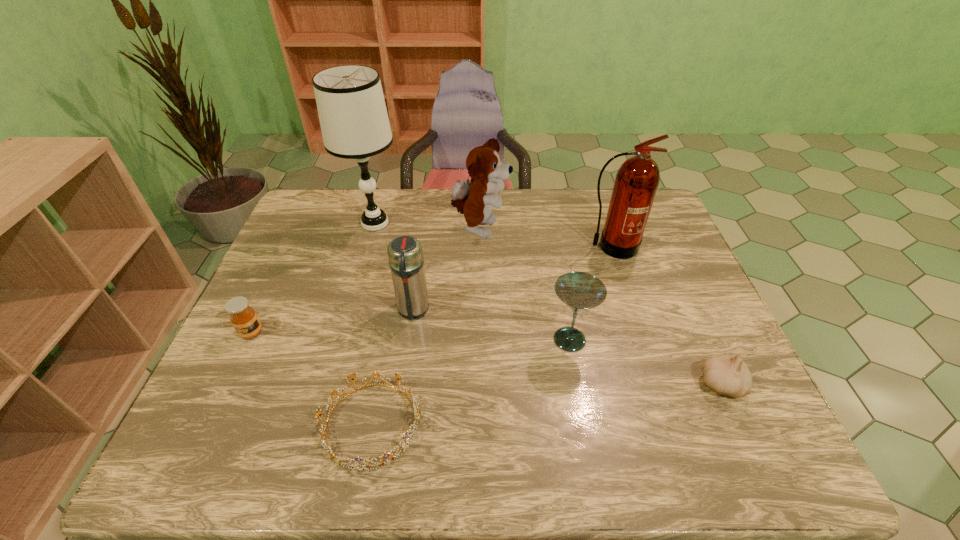
You are a GUI agent. You are given a task and a screenshot of the screen. Output one action in this format:
    pyautogui.click(x=<x>, y=<y>)
    Task: Click on the free point between the tallest object and the fourth object from right to left
    The height and width of the screenshot is (540, 960).
    Given the screenshot: What is the action you would take?
    pyautogui.click(x=427, y=226)

The width and height of the screenshot is (960, 540). What are the coordinates of `free spot between the seventh object from left to right and the shortest object` in the screenshot? It's located at (492, 335).

Find the location of a particular element. This screenshot has width=960, height=540. empty space that is in between the table lamp and the third object from right to left is located at coordinates (472, 281).

I want to click on vacant area that lies between the shortest object and the fourth object from right to left, so click(426, 327).

Identify the location of vacant area that lies between the tallest object and the shortest object. (373, 324).

Where is `unoccupied area between the table lamp and the garlic`? The height and width of the screenshot is (540, 960). unoccupied area between the table lamp and the garlic is located at coordinates (548, 303).

What are the coordinates of `vacant region between the garlic and the sixth shortest object` in the screenshot? It's located at coord(601,307).

You are a GUI agent. You are given a task and a screenshot of the screen. Output one action in this format:
    pyautogui.click(x=<x>, y=<y>)
    Task: Click on the free space that is in between the third object from right to left and the rightmost object
    This screenshot has width=960, height=540.
    Given the screenshot: What is the action you would take?
    pyautogui.click(x=645, y=362)

Locate which object ranks sixth in proximity to the fifth shortest object. Please provide its 2D coordinates. Your answer should be formatted as a tuple, i.e. [(x, y)], where the tuple contains the x and y coordinates of a point satisfying the conditions above.

[(637, 180)]

Identify which object is the third closest to the puppy. Please provide its 2D coordinates. Your answer should be formatted as a tuple, i.e. [(x, y)], where the tuple contains the x and y coordinates of a point satisfying the conditions above.

[(637, 180)]